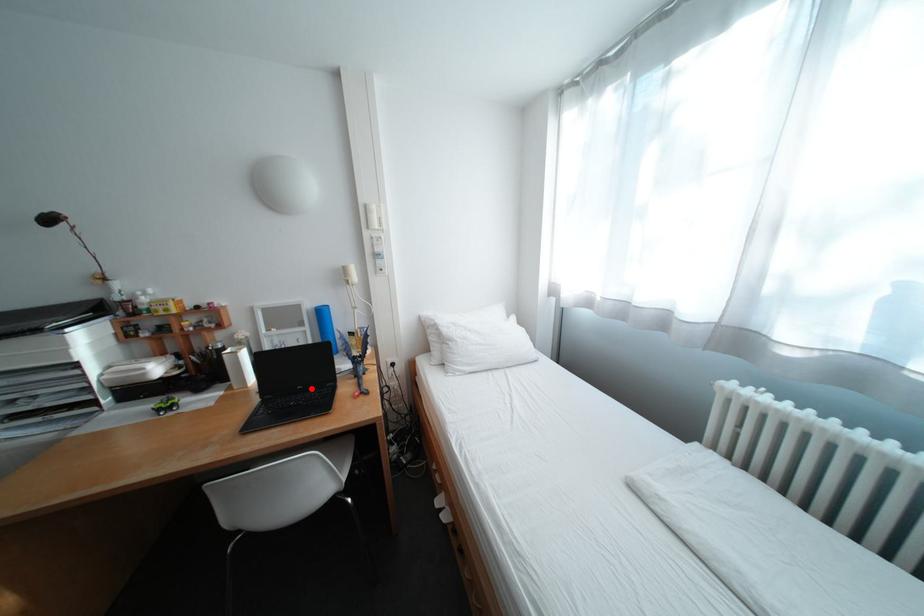
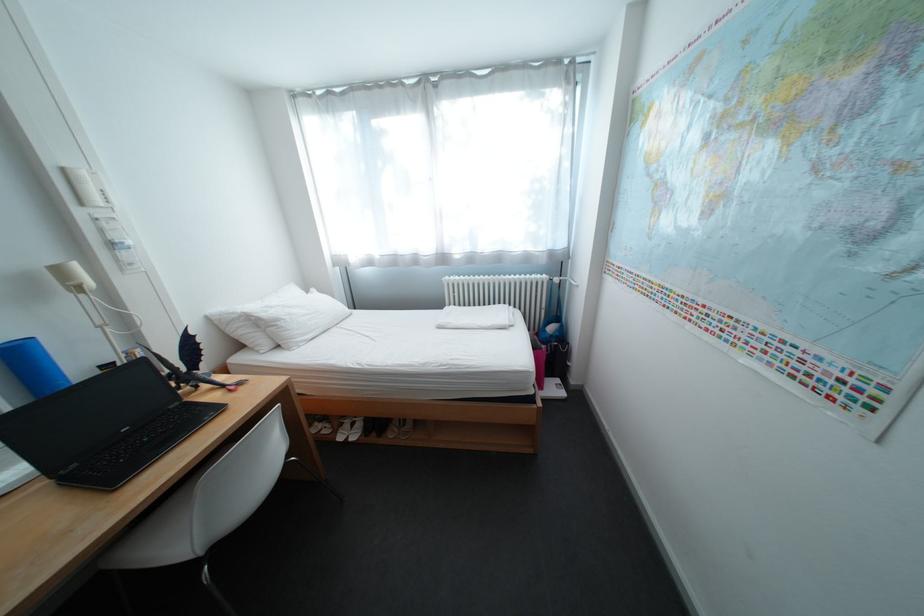
In the second image, find the point that corresponds to the highlighted location in the first image.

(137, 431)